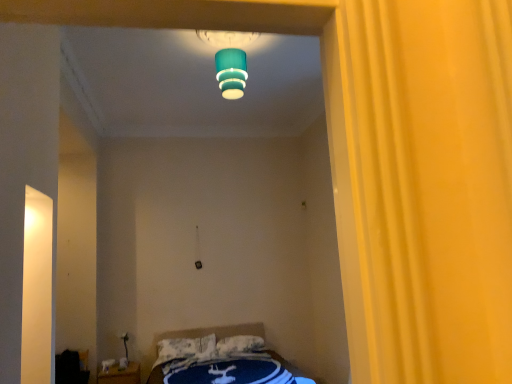
Question: Does white soft pillow at lower center, the first pillow when ordered from right to left, have a greater width compared to teal matte lampshade at upper center?

Choices:
 (A) no
 (B) yes

Answer: (A)

Question: Could teal matte lampshade at upper center be considered to be inside white soft pillow at lower center, the 2th pillow when ordered from left to right?

Choices:
 (A) yes
 (B) no

Answer: (B)

Question: Can you see white soft pillow at lower center, the first pillow when ordered from right to left, touching teal matte lampshade at upper center?

Choices:
 (A) no
 (B) yes

Answer: (A)

Question: Considering the relative sizes of white soft pillow at lower center, the 2th pillow when ordered from left to right, and teal matte lampshade at upper center in the image provided, is white soft pillow at lower center, the 2th pillow when ordered from left to right, bigger than teal matte lampshade at upper center?

Choices:
 (A) yes
 (B) no

Answer: (B)

Question: Is white soft pillow at lower center, the 2th pillow when ordered from left to right, to the left of teal matte lampshade at upper center from the viewer's perspective?

Choices:
 (A) no
 (B) yes

Answer: (A)

Question: Relative to blue fabric bed at lower center, is black fabric bag at lower left in front or behind?

Choices:
 (A) front
 (B) behind

Answer: (B)

Question: Considering the positions of black fabric bag at lower left and blue fabric bed at lower center in the image, is black fabric bag at lower left wider or thinner than blue fabric bed at lower center?

Choices:
 (A) thin
 (B) wide

Answer: (A)

Question: Looking at the image, does black fabric bag at lower left seem bigger or smaller compared to blue fabric bed at lower center?

Choices:
 (A) big
 (B) small

Answer: (B)

Question: From the image's perspective, is black fabric bag at lower left above or below blue fabric bed at lower center?

Choices:
 (A) above
 (B) below

Answer: (B)

Question: Is white textured pillow at center, the 1th pillow positioned from the left, inside the boundaries of white soft pillow at lower center, the first pillow when ordered from right to left, or outside?

Choices:
 (A) inside
 (B) outside

Answer: (B)

Question: Considering the positions of white textured pillow at center, the 1th pillow positioned from the left, and white soft pillow at lower center, the first pillow when ordered from right to left, in the image, is white textured pillow at center, the 1th pillow positioned from the left, wider or thinner than white soft pillow at lower center, the first pillow when ordered from right to left,?

Choices:
 (A) wide
 (B) thin

Answer: (A)

Question: Considering the positions of point (189, 360) and point (252, 347), is point (189, 360) closer or farther from the camera than point (252, 347)?

Choices:
 (A) farther
 (B) closer

Answer: (B)

Question: From the image's perspective, is white textured pillow at center, which is the second pillow in right-to-left order, positioned above or below white soft pillow at lower center, the first pillow when ordered from right to left?

Choices:
 (A) below
 (B) above

Answer: (A)

Question: From a real-world perspective, relative to white textured pillow at center, which is the second pillow in right-to-left order, is teal matte lampshade at upper center vertically above or below?

Choices:
 (A) above
 (B) below

Answer: (A)

Question: Is point (216, 54) positioned closer to the camera than point (202, 342)?

Choices:
 (A) closer
 (B) farther

Answer: (A)